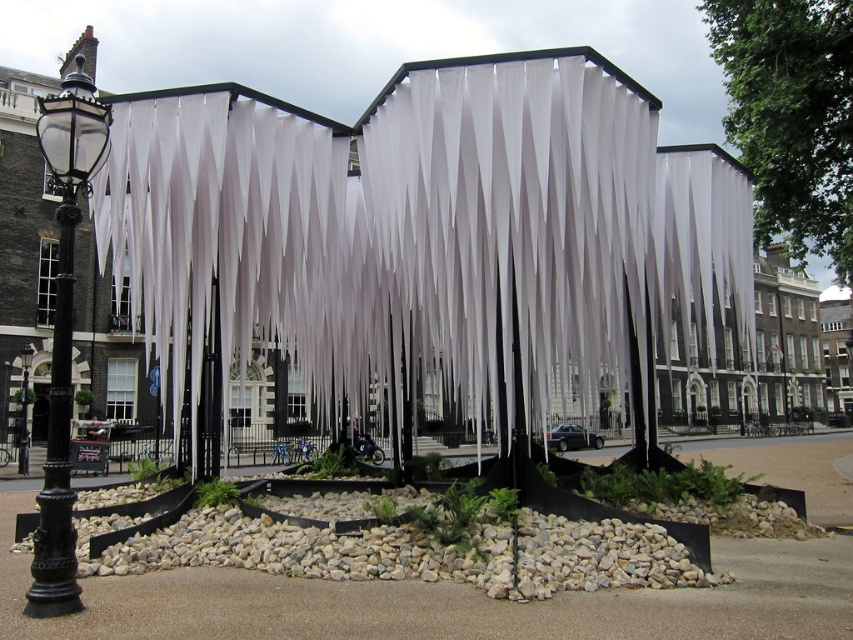
Question: Which object appears closest to the camera in this image?

Choices:
 (A) black glass lamp post at left
 (B) white fabric curtain at center

Answer: (A)

Question: Which point appears closest to the camera in this image?

Choices:
 (A) (68, 129)
 (B) (473, 316)

Answer: (A)

Question: Can you confirm if white fabric curtain at center is wider than black glass lamp post at left?

Choices:
 (A) yes
 (B) no

Answer: (A)

Question: Does white fabric curtain at center have a smaller size compared to black glass lamp post at left?

Choices:
 (A) no
 (B) yes

Answer: (B)

Question: Can you confirm if white fabric curtain at center is thinner than black glass lamp post at left?

Choices:
 (A) yes
 (B) no

Answer: (B)